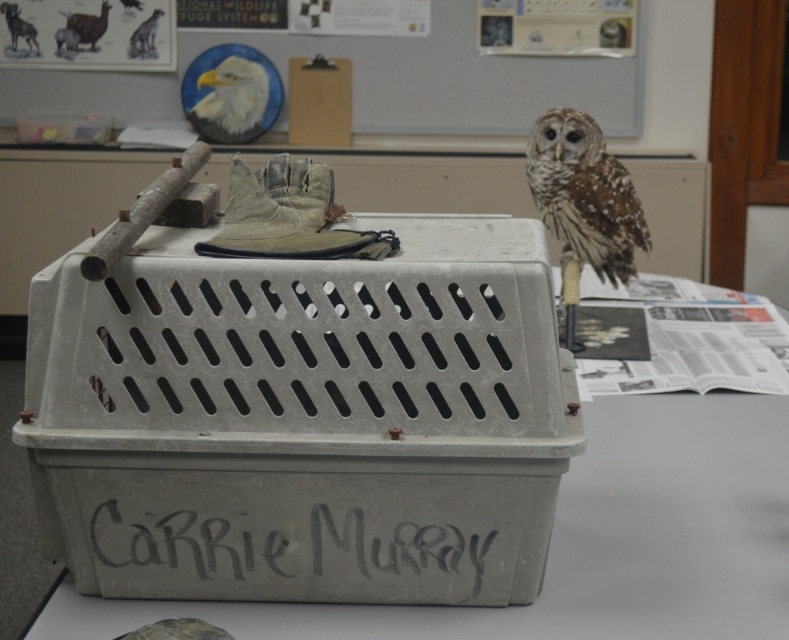
Is point (776, 609) in front of point (255, 112)?

Yes, point (776, 609) is in front of point (255, 112).

Does point (731, 474) lie behind point (234, 113)?

No, it is not.

Which is in front, point (122, 605) or point (200, 104)?

Point (122, 605) is more forward.

Where is `gray plastic crate at center`? gray plastic crate at center is located at coordinates (586, 541).

The image size is (789, 640). Identify the location of gray plastic crate at center. (586, 541).

Is gray plastic crate at center below brown speckled feathers at upper right?

Indeed, gray plastic crate at center is positioned under brown speckled feathers at upper right.

The width and height of the screenshot is (789, 640). What do you see at coordinates (586, 541) in the screenshot?
I see `gray plastic crate at center` at bounding box center [586, 541].

Identify the location of gray plastic crate at center. This screenshot has height=640, width=789. (586, 541).

Does brown speckled feathers at upper right have a smaller size compared to brown speckled owl at upper right?

No, brown speckled feathers at upper right is not smaller than brown speckled owl at upper right.

Does point (581, 125) lie behind point (230, 80)?

No, it is in front of (230, 80).

The width and height of the screenshot is (789, 640). Describe the element at coordinates (582, 204) in the screenshot. I see `brown speckled feathers at upper right` at that location.

Image resolution: width=789 pixels, height=640 pixels. In order to click on brown speckled feathers at upper right in this screenshot , I will do `click(582, 204)`.